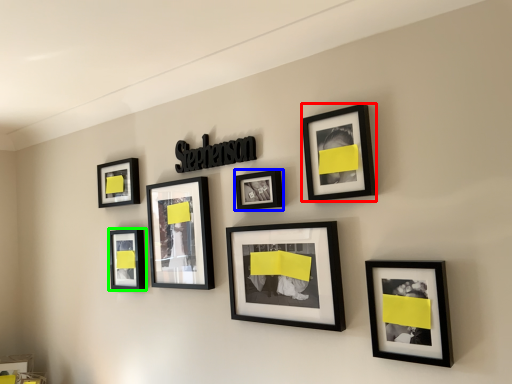
Question: Which object is the farthest from picture frame (highlighted by a red box)? Choose among these: picture frame (highlighted by a blue box) or picture frame (highlighted by a green box).

Choices:
 (A) picture frame
 (B) picture frame

Answer: (B)